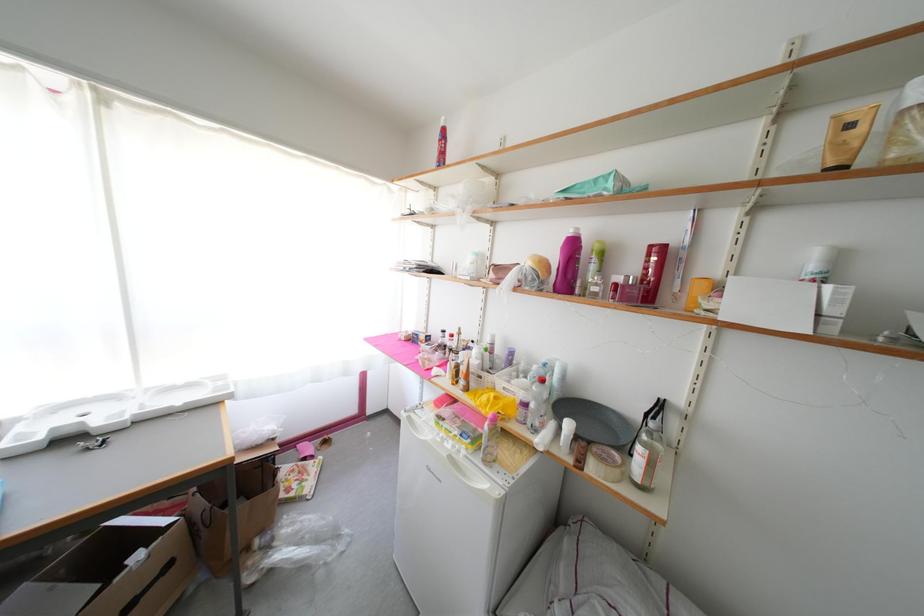
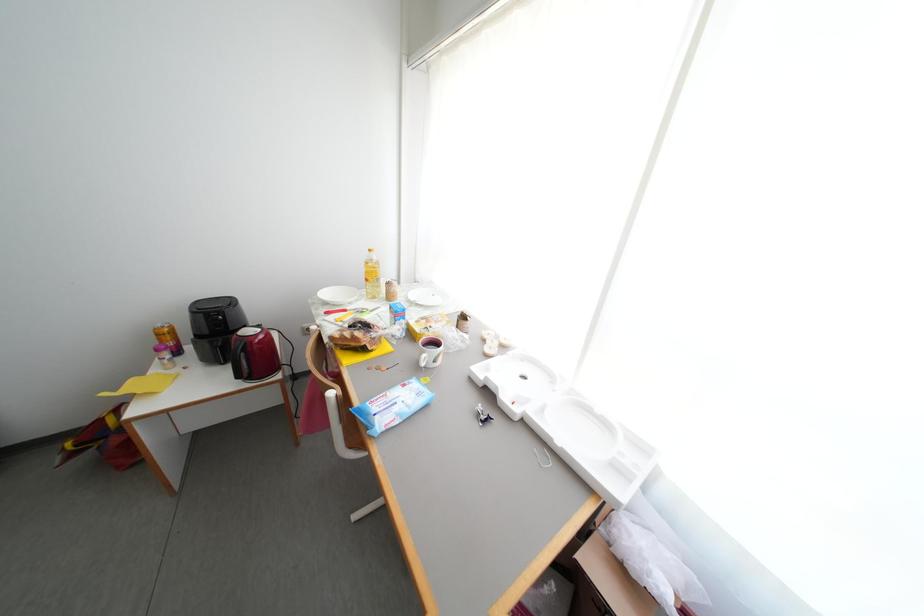
The images are taken continuously from a first-person perspective. In which direction is your viewpoint rotating?

The camera's rotation is toward left-down.